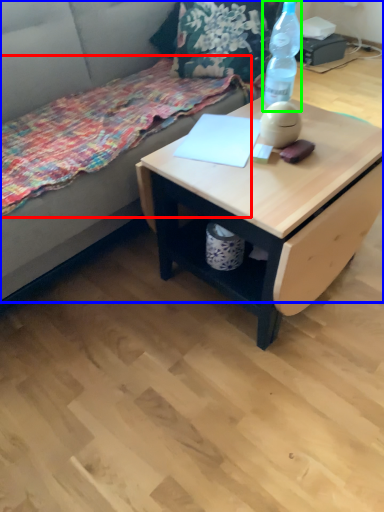
Question: Estimate the real-world distances between objects in this image. Which object is farther from blanket (highlighted by a red box), studio couch (highlighted by a blue box) or bottle (highlighted by a green box)?

Choices:
 (A) studio couch
 (B) bottle

Answer: (B)